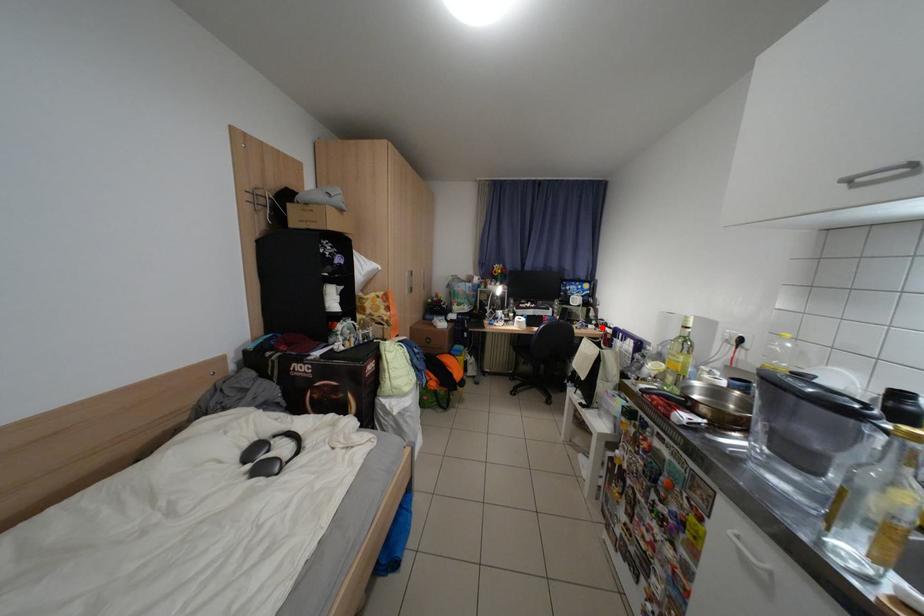
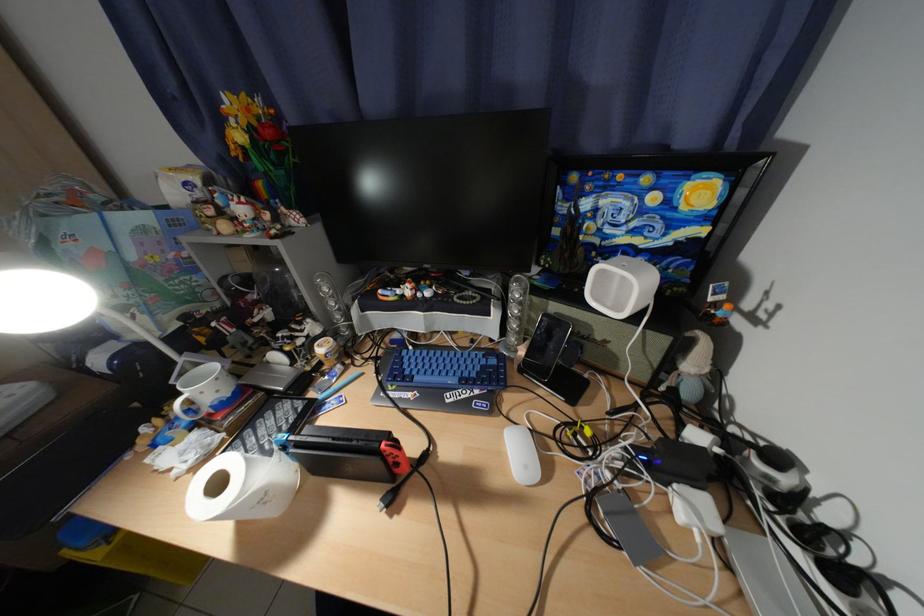
In the second image, find the point that corresponds to the highlighted location in the first image.

(700, 508)